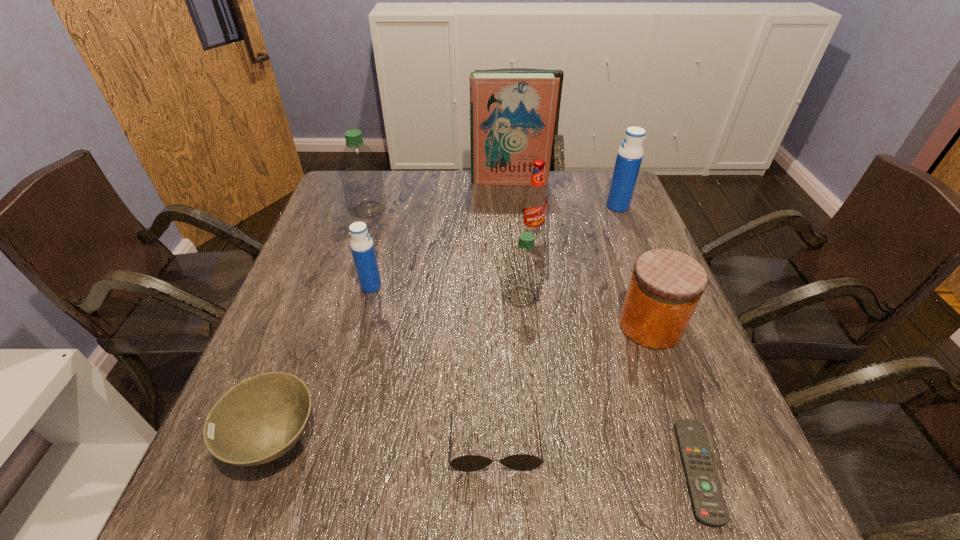
You are a GUI agent. You are given a task and a screenshot of the screen. Output one action in this format:
    pyautogui.click(x=<x>, y=<y>)
    Task: Click on the unoccupied position between the ninth tallest object and the right blue water bottle
    
    Given the screenshot: What is the action you would take?
    click(556, 323)

Where is `empty location between the bowl and the orange jar`? Image resolution: width=960 pixels, height=540 pixels. empty location between the bowl and the orange jar is located at coordinates (463, 383).

Locate an element on the screen. This screenshot has height=540, width=960. free spot between the bigger green water bottle and the root beer is located at coordinates (450, 221).

Locate an element on the screen. Image resolution: width=960 pixels, height=540 pixels. vacant region between the nearer blue water bottle and the remote control is located at coordinates (535, 379).

At what (x,y) coordinates should I click in order to perform the action: click on the second closest object to the red root beer. Please return your answer as a coordinate pair (x, y). The image size is (960, 540). Looking at the image, I should click on (629, 157).

Identify the location of object that ranks as the closest to the orange jar. The image size is (960, 540). (709, 507).

The image size is (960, 540). Identify the location of water bottle that stands as the second closest to the nearer green water bottle. (629, 157).

The height and width of the screenshot is (540, 960). I want to click on water bottle that is the fourth closest to the ninth tallest object, so click(629, 157).